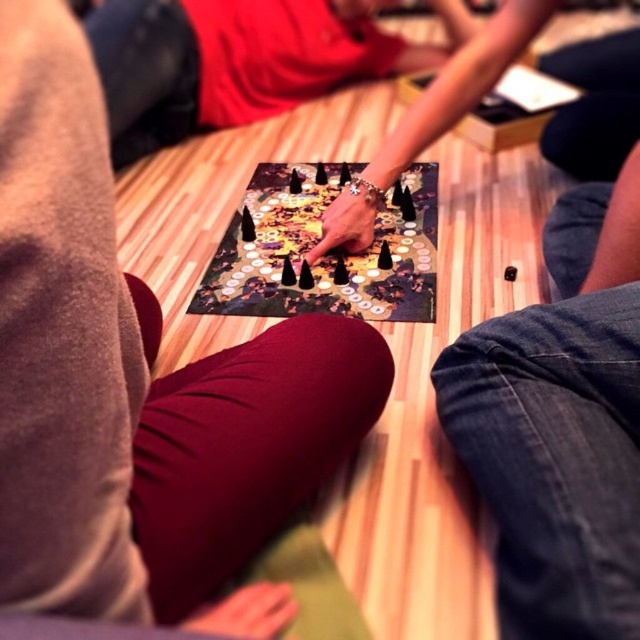
You are a photographer trying to capture a closeup of the smooth red shirt at center without including the denim pants at lower right in the frame. Based on their positions, is this possible?

The denim pants at lower right is in front of the smooth red shirt at center, so it would block the view. Therefore, capturing a closeup of the smooth red shirt at center without including the denim pants at lower right is not possible.

In the scene shown: You are standing at the center of the board game scene. You need to move to the location of the denim pants at lower right. What are the coordinates of the point you should move to?

The coordinates of the denim pants at lower right are at point (561, 422).